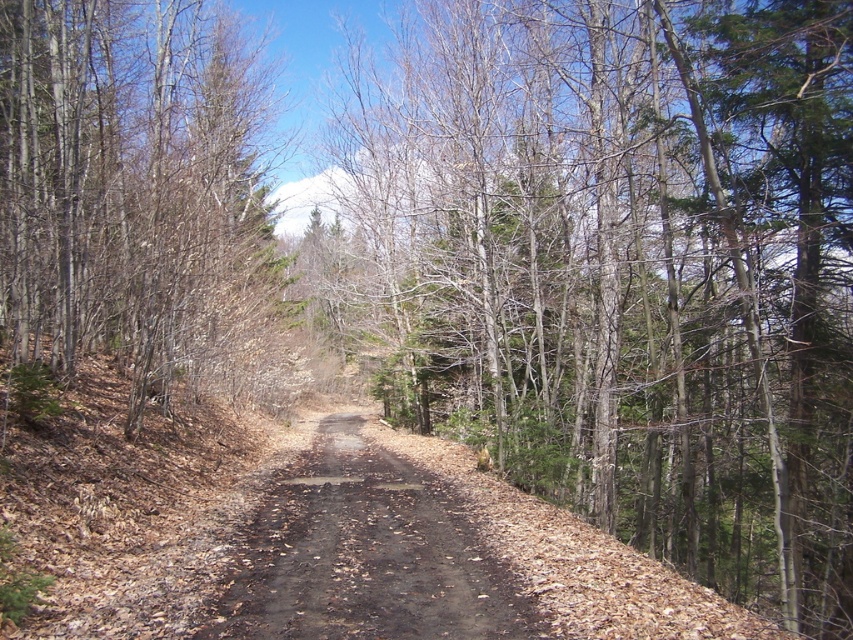
You are a hiker planning to take a photo of the brown bark tree at left and the brown dirt track at center from a spot where both are visible. Based on their heights, which object will appear larger in the photo?

The brown bark tree at left will appear larger in the photo because it is taller than the brown dirt track at center.